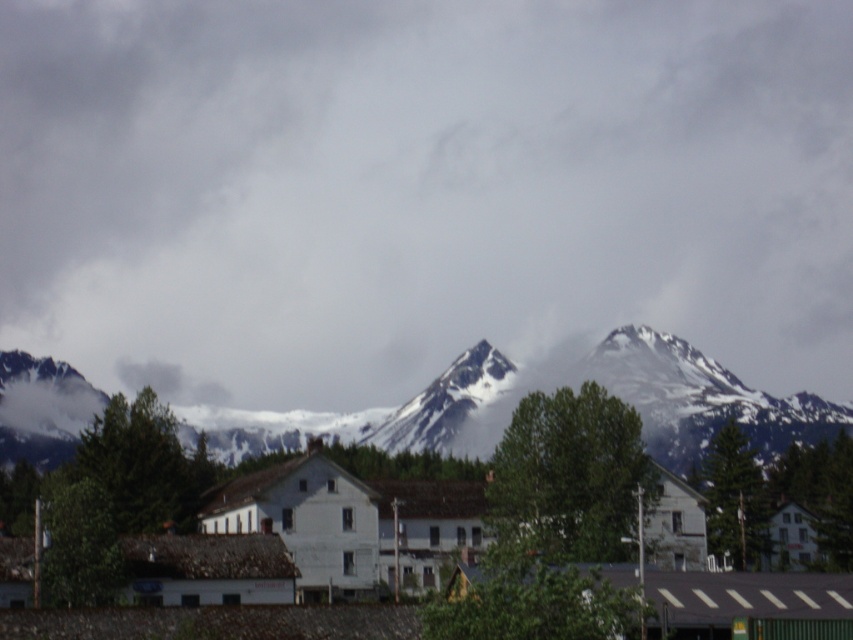
Question: Can you confirm if cloudy sky at upper center is positioned to the left of snowy rock mountain at center?

Choices:
 (A) yes
 (B) no

Answer: (A)

Question: Is cloudy sky at upper center below snowy rock mountain at center?

Choices:
 (A) no
 (B) yes

Answer: (A)

Question: Which point is farther from the camera taking this photo?

Choices:
 (A) click(x=123, y=227)
 (B) click(x=624, y=349)

Answer: (A)

Question: Which object is farther from the camera taking this photo?

Choices:
 (A) cloudy sky at upper center
 (B) snowy rock mountain at center

Answer: (A)

Question: Is the position of cloudy sky at upper center less distant than that of snowy rock mountain at center?

Choices:
 (A) no
 (B) yes

Answer: (A)